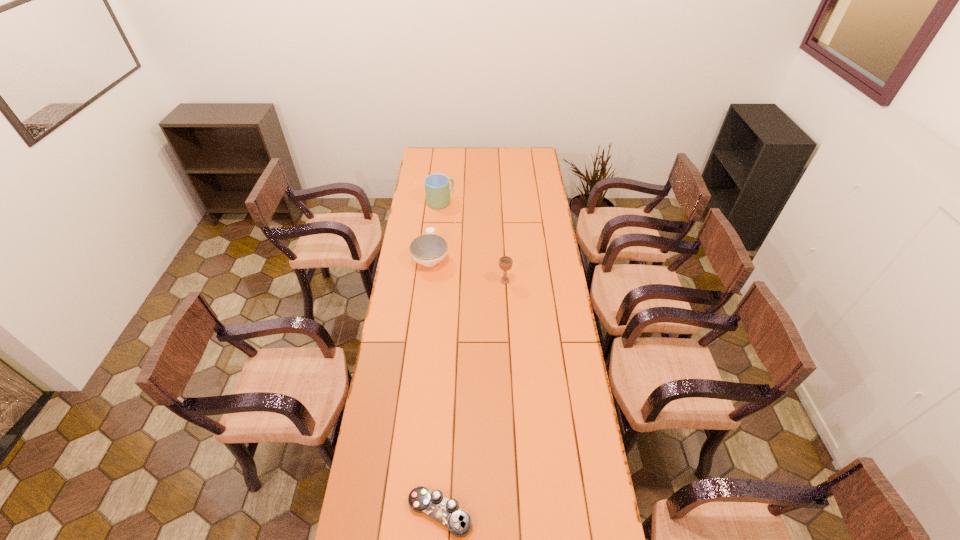
Locate an element on the screen. free space located on the side with the handle of the chinaware is located at coordinates (434, 228).

I want to click on free space located 0.370m on the side with the handle of the chinaware, so click(437, 198).

Locate an element on the screen. This screenshot has width=960, height=540. free region located on the right of the shortest object is located at coordinates (568, 512).

Locate an element on the screen. The height and width of the screenshot is (540, 960). mug present at the left edge is located at coordinates (437, 189).

The width and height of the screenshot is (960, 540). I want to click on chinaware that is at the left edge, so click(x=429, y=249).

What are the coordinates of `control that is at the left edge` in the screenshot? It's located at (446, 512).

Where is `vacant area at the far edge of the desktop`? The width and height of the screenshot is (960, 540). vacant area at the far edge of the desktop is located at coordinates (486, 150).

Find the location of a particular element. This screenshot has height=540, width=960. vacant space at the left edge of the desktop is located at coordinates (422, 206).

Where is `vacant space at the right edge of the desktop`? vacant space at the right edge of the desktop is located at coordinates (527, 208).

In the image, there is a desktop. Identify the location of vacant space at the far right corner. (526, 157).